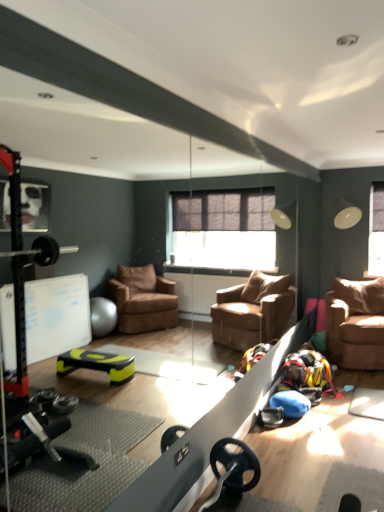
This screenshot has height=512, width=384. In order to click on brown suede armchair at right in this screenshot , I will do `click(356, 323)`.

The width and height of the screenshot is (384, 512). Describe the element at coordinates (356, 323) in the screenshot. I see `brown suede armchair at right` at that location.

Locate an element on the screen. This screenshot has width=384, height=512. brown suede armchair at right is located at coordinates (356, 323).